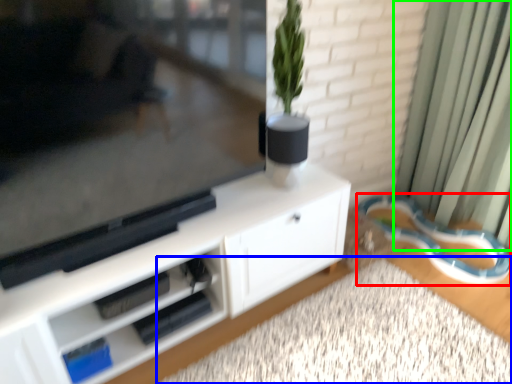
Question: Which is nearer to the leash (highlighted by a red box)? plain (highlighted by a blue box) or curtain (highlighted by a green box).

Choices:
 (A) plain
 (B) curtain

Answer: (B)